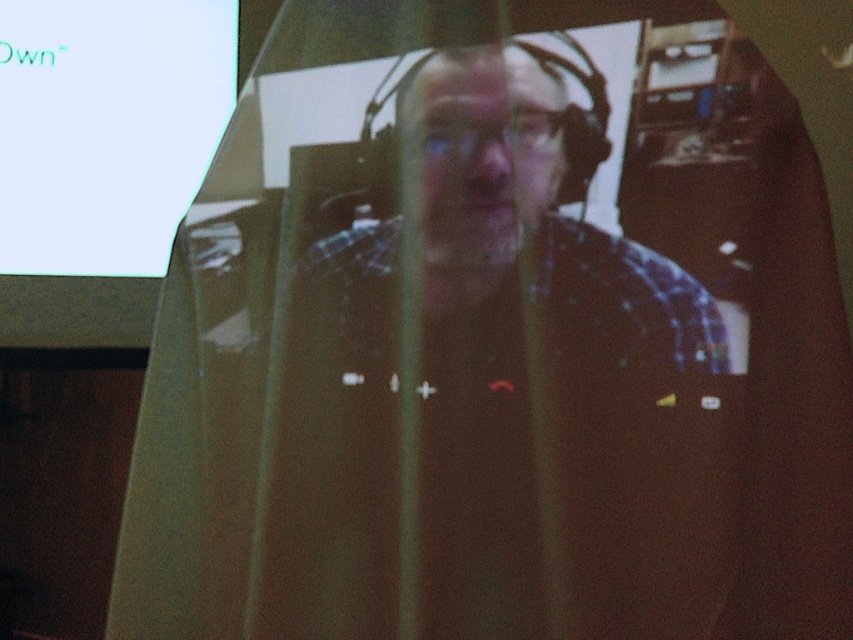
Question: Does plaid shirt at center appear on the right side of white glossy projection screen at upper left?

Choices:
 (A) no
 (B) yes

Answer: (B)

Question: Is plaid shirt at center in front of white glossy projection screen at upper left?

Choices:
 (A) no
 (B) yes

Answer: (B)

Question: Which point is farther to the camera?

Choices:
 (A) plaid shirt at center
 (B) white glossy projection screen at upper left

Answer: (B)

Question: Which of the following is the closest to the observer?

Choices:
 (A) white glossy projection screen at upper left
 (B) plaid shirt at center

Answer: (B)

Question: Does plaid shirt at center have a smaller size compared to white glossy projection screen at upper left?

Choices:
 (A) yes
 (B) no

Answer: (A)